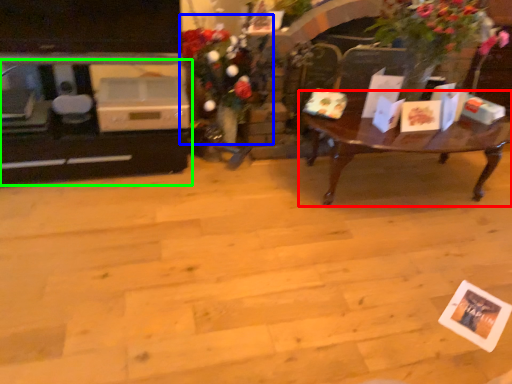
Question: Based on their relative distances, which object is nearer to coffee table (highlighted by a red box)? Choose from floral arrangement (highlighted by a blue box) and entertainment center (highlighted by a green box).

Choices:
 (A) floral arrangement
 (B) entertainment center

Answer: (A)